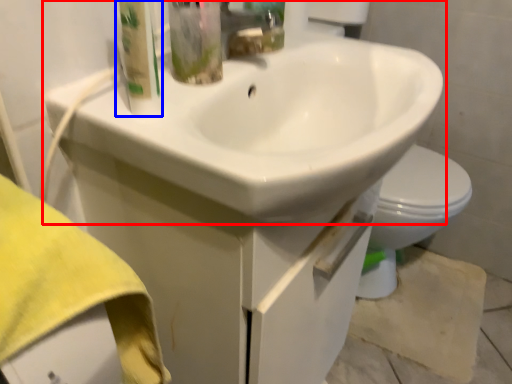
Question: Which point is closer to the camera, sink (highlighted by a red box) or cleaning product (highlighted by a blue box)?

Choices:
 (A) sink
 (B) cleaning product

Answer: (A)